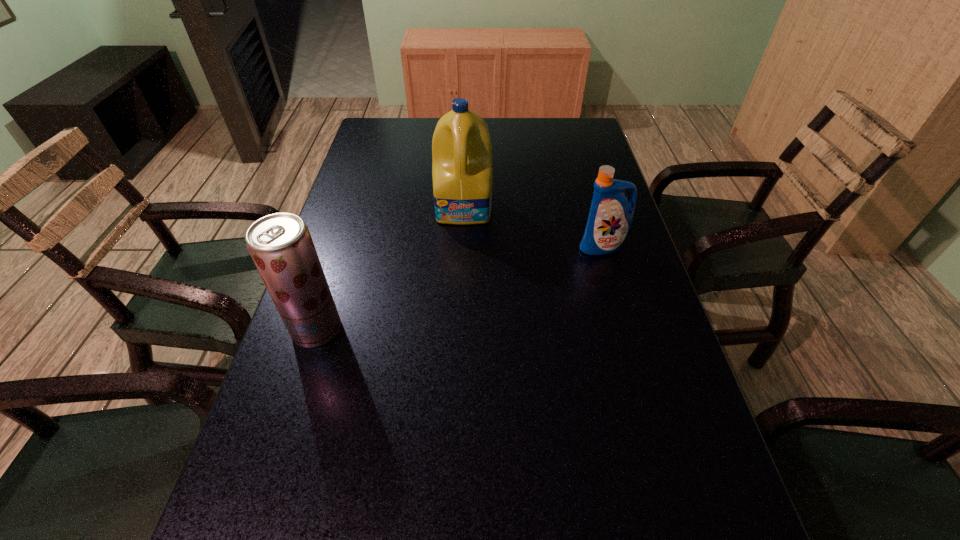
This screenshot has width=960, height=540. Find the location of `object that is at the right edge`. object that is at the right edge is located at coordinates (610, 217).

Find the location of a particular element. The width and height of the screenshot is (960, 540). free space at the left edge of the desktop is located at coordinates (341, 197).

I want to click on blank area at the right edge, so pyautogui.click(x=610, y=278).

You are a GUI agent. You are given a task and a screenshot of the screen. Output one action in this format:
    pyautogui.click(x=<x>, y=<y>)
    Task: Click on the free space at the far left corner of the desktop
    This screenshot has width=960, height=540.
    Given the screenshot: What is the action you would take?
    pyautogui.click(x=379, y=123)

Identify the location of free spot between the shortest object and the fruit juice. This screenshot has width=960, height=540. (460, 288).

Where is `blank region between the taller detergent and the fruit juice`? blank region between the taller detergent and the fruit juice is located at coordinates (391, 269).

The width and height of the screenshot is (960, 540). In order to click on empty space that is in between the nearer detergent and the fruit juice in this screenshot , I will do `click(460, 288)`.

I want to click on vacant space in between the farther detergent and the rightmost object, so click(534, 227).

You are a GUI agent. You are given a task and a screenshot of the screen. Output one action in this format:
    pyautogui.click(x=<x>, y=<y>)
    Task: Click on the object identified as the closest to the leftmost object
    
    Given the screenshot: What is the action you would take?
    pyautogui.click(x=461, y=146)

Select which object appears as the second closest to the fruit juice. Please provide its 2D coordinates. Your answer should be formatted as a tuple, i.e. [(x, y)], where the tuple contains the x and y coordinates of a point satisfying the conditions above.

[(610, 217)]